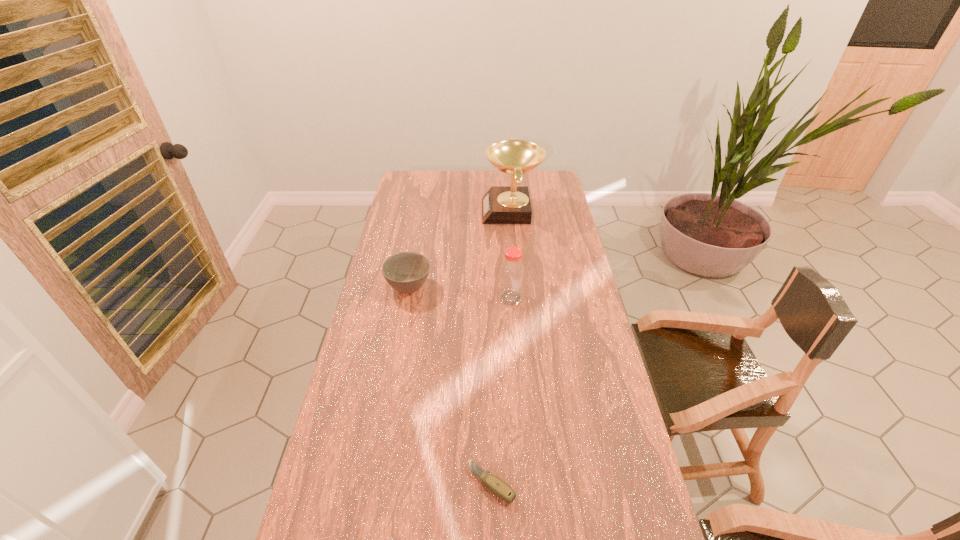
Locate an element on the screen. free point located 0.210m on the right of the third shortest object is located at coordinates (581, 298).

Find the location of `vacant space situated on the back of the leftmost object`. vacant space situated on the back of the leftmost object is located at coordinates (416, 252).

The image size is (960, 540). I want to click on blank space located 0.180m on the right of the pocketknife, so click(x=587, y=483).

The width and height of the screenshot is (960, 540). In order to click on object present at the far edge in this screenshot , I will do `click(511, 204)`.

The image size is (960, 540). In order to click on object that is at the left edge in this screenshot , I will do click(406, 272).

Locate an element on the screen. This screenshot has height=540, width=960. object located at the right edge is located at coordinates (511, 204).

I want to click on object positioned at the far right corner, so click(x=511, y=204).

Locate an element on the screen. vacant space at the far edge of the desktop is located at coordinates (465, 185).

The width and height of the screenshot is (960, 540). What are the coordinates of `free space at the left edge` in the screenshot? It's located at (420, 229).

What are the coordinates of `vacant area at the right edge` in the screenshot? It's located at (558, 224).